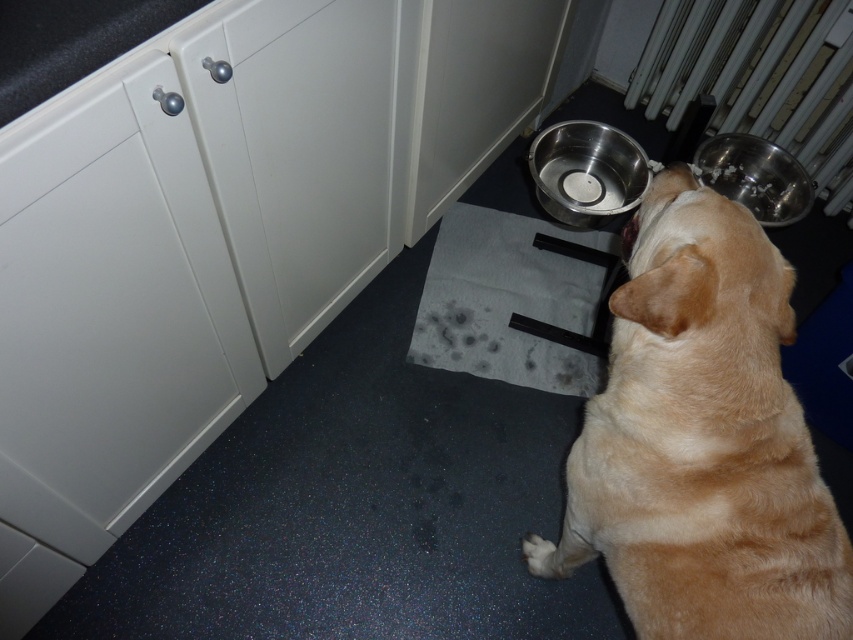
Question: Does light brown fur at center lie behind metallic silver bowl at lower right?

Choices:
 (A) no
 (B) yes

Answer: (A)

Question: Can you confirm if light brown fur at center is positioned to the left of metallic radiator at upper right?

Choices:
 (A) no
 (B) yes

Answer: (B)

Question: Is light brown fur at center closer to the viewer compared to metallic radiator at upper right?

Choices:
 (A) no
 (B) yes

Answer: (B)

Question: Considering the real-world distances, which object is closest to the metallic radiator at upper right?

Choices:
 (A) metallic silver bowl at lower right
 (B) metallic silver bowl at lower center

Answer: (A)

Question: Which object is the closest to the metallic radiator at upper right?

Choices:
 (A) light brown fur at center
 (B) metallic silver bowl at lower right
 (C) metallic silver bowl at lower center

Answer: (B)

Question: Which point is farther to the camera?

Choices:
 (A) metallic silver bowl at lower center
 (B) metallic radiator at upper right
 (C) metallic silver bowl at lower right
 (D) light brown fur at center

Answer: (B)